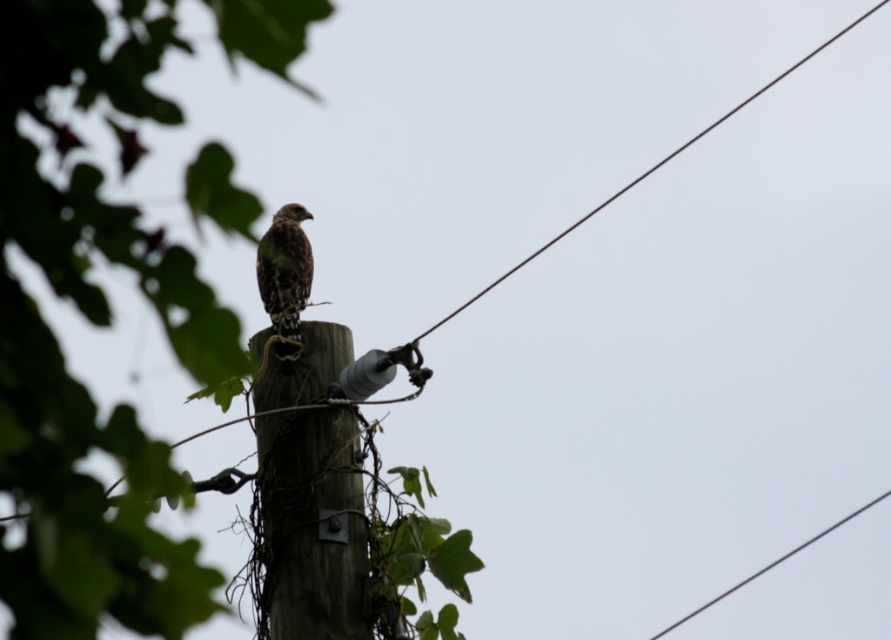
From the picture: You are a birdwatcher trying to observe the brown speckled falcon at center through your telescope. The green leafy tree at center is blocking your view. Can you adjust your position to see the falcon without moving the tree?

The green leafy tree at center is in front of the brown speckled falcon at center, so you can move to the side of the tree to get a clear view of the falcon.

You are a birdwatcher trying to observe the hawk. You have a telescope that can focus on objects up to 100 meters away. The green leafy tree at center is blocking your view of the brown wood post at center where the hawk is perched. Can you still see the hawk through the telescope?

The green leafy tree at center is much taller than the brown wood post at center, so the tree might block the view of the hawk on the post. However, if the telescope can adjust its angle or you move to a different position to avoid the tree, you might still see the hawk.

You are a bird with a wingspan of 4 feet. You want to fly from the green leafy tree at center to the brown wood post at center. Can you make the flight without flapping your wings? Explain your reasoning.

The distance between the green leafy tree at center and the brown wood post at center is 7.95 feet. Since your wingspan is 4 feet, you have enough space to glide between them without flapping your wings as the distance is greater than your wingspan.